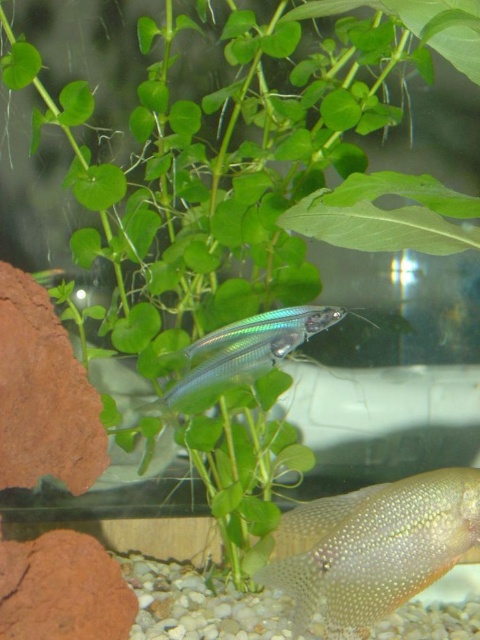
You are a marine biologist observing the aquarium. You notice a point marked at coordinates (374, 547). Which object in the aquarium is this point located on?

The point at coordinates (374, 547) is located on the translucent glass fish at center.

You are an aquarium caretaker observing the aquarium. You notice two fish labeled as translucent glass fish at center and transparent glass fish at center. Which one is positioned lower in the water? Please refer to their exact labels when answering.

The translucent glass fish at center is positioned lower than the transparent glass fish at center according to their labels.

You are a robotic fish in the aquarium. You need to navigate from your current position to the exit located at point (x=201, y=372). However, there is an obstacle at point (x=432, y=480). Can you safely reach the exit without colliding with the obstacle?

Point (x=432, y=480) is in front of point (x=201, y=372), so the obstacle is blocking the path to the exit. You cannot safely reach the exit without colliding with the obstacle.